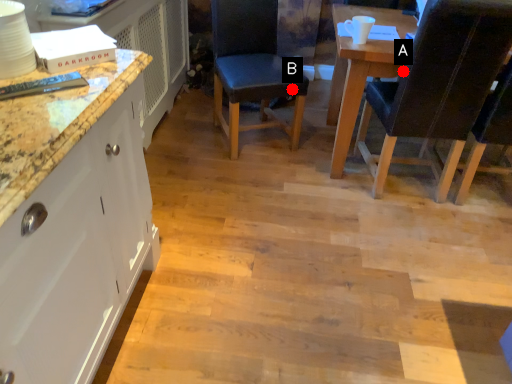
Question: Two points are circled on the image, labeled by A and B beside each circle. Which point is closer to the camera?

Choices:
 (A) A is closer
 (B) B is closer

Answer: (A)